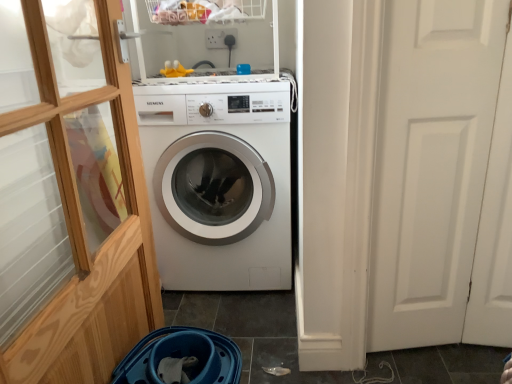
Question: Is white plastic shelf at upper center bigger than white glossy washing machine at center?

Choices:
 (A) yes
 (B) no

Answer: (B)

Question: Is white plastic shelf at upper center further to the viewer compared to white glossy washing machine at center?

Choices:
 (A) no
 (B) yes

Answer: (A)

Question: Is white plastic shelf at upper center outside white glossy washing machine at center?

Choices:
 (A) yes
 (B) no

Answer: (A)

Question: Could white glossy washing machine at center be considered to be inside white plastic shelf at upper center?

Choices:
 (A) yes
 (B) no

Answer: (B)

Question: Can you confirm if white plastic shelf at upper center is thinner than white glossy washing machine at center?

Choices:
 (A) yes
 (B) no

Answer: (A)

Question: Is white matte door at right inside the boundaries of white glossy washing machine at center, or outside?

Choices:
 (A) outside
 (B) inside

Answer: (A)

Question: From the image's perspective, is white matte door at right located above or below white glossy washing machine at center?

Choices:
 (A) above
 (B) below

Answer: (B)

Question: Looking at the image, does white matte door at right seem bigger or smaller compared to white glossy washing machine at center?

Choices:
 (A) big
 (B) small

Answer: (B)

Question: In terms of width, does white matte door at right look wider or thinner when compared to white glossy washing machine at center?

Choices:
 (A) wide
 (B) thin

Answer: (B)

Question: Is white glossy washing machine at center wider or thinner than transparent wood glass door at left?

Choices:
 (A) thin
 (B) wide

Answer: (B)

Question: Is white glossy washing machine at center inside the boundaries of transparent wood glass door at left, or outside?

Choices:
 (A) inside
 (B) outside

Answer: (B)

Question: In the image, is white glossy washing machine at center positioned in front of or behind transparent wood glass door at left?

Choices:
 (A) front
 (B) behind

Answer: (B)

Question: Is white glossy washing machine at center bigger or smaller than transparent wood glass door at left?

Choices:
 (A) big
 (B) small

Answer: (A)

Question: Considering the positions of transparent wood glass door at left and white matte door at right in the image, is transparent wood glass door at left wider or thinner than white matte door at right?

Choices:
 (A) wide
 (B) thin

Answer: (A)

Question: Looking at the image, does transparent wood glass door at left seem bigger or smaller compared to white matte door at right?

Choices:
 (A) big
 (B) small

Answer: (A)